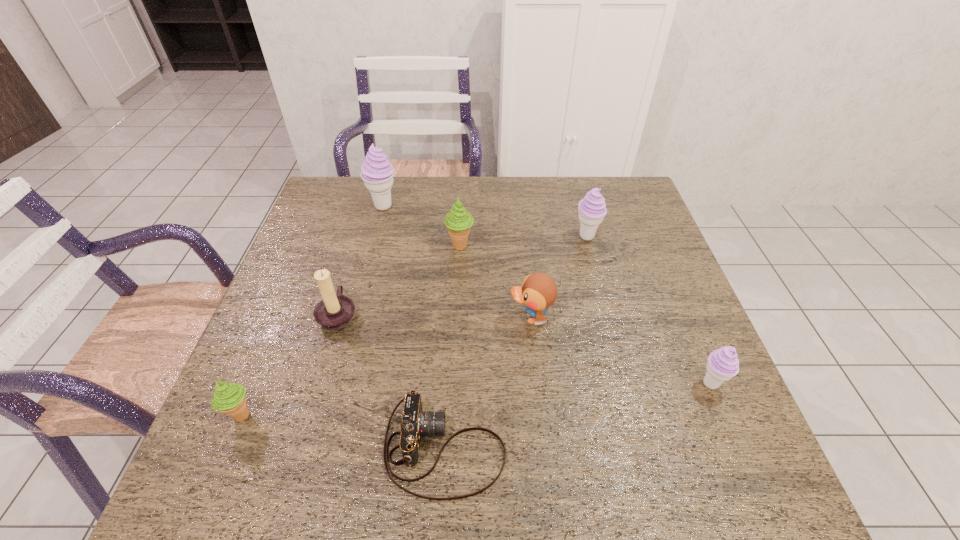
You are a GUI agent. You are given a task and a screenshot of the screen. Output one action in this format:
    pyautogui.click(x=<x>, y=<y>)
    Task: Click on the left green icecream
    Image resolution: width=960 pixels, height=540 pixels.
    Given the screenshot: What is the action you would take?
    (229, 398)

Locate an element on the screen. the sixth farthest object is located at coordinates (723, 364).

At what (x,y) coordinates should I click in order to perform the action: click on the nearest purple icecream. Please return your answer as a coordinate pair (x, y). Looking at the image, I should click on (723, 364).

Locate an element on the screen. This screenshot has height=540, width=960. brown camera is located at coordinates (415, 424).

Locate an element on the screen. the shortest object is located at coordinates (415, 424).

The height and width of the screenshot is (540, 960). Identify the location of vacant region located 0.070m on the back of the biggest purple icecream. (389, 185).

Find the location of a particular element. The width and height of the screenshot is (960, 540). free spot located on the front of the second purple icecream from right to left is located at coordinates (593, 260).

Locate an element on the screen. The height and width of the screenshot is (540, 960). vacant region located on the right of the third icecream from left to right is located at coordinates (563, 246).

I want to click on free point located 0.220m on the wick of the candle holder, so click(447, 314).

Image resolution: width=960 pixels, height=540 pixels. What are the coordinates of `vacant space positioned on the front-facing side of the third object from right to left` in the screenshot? It's located at (484, 318).